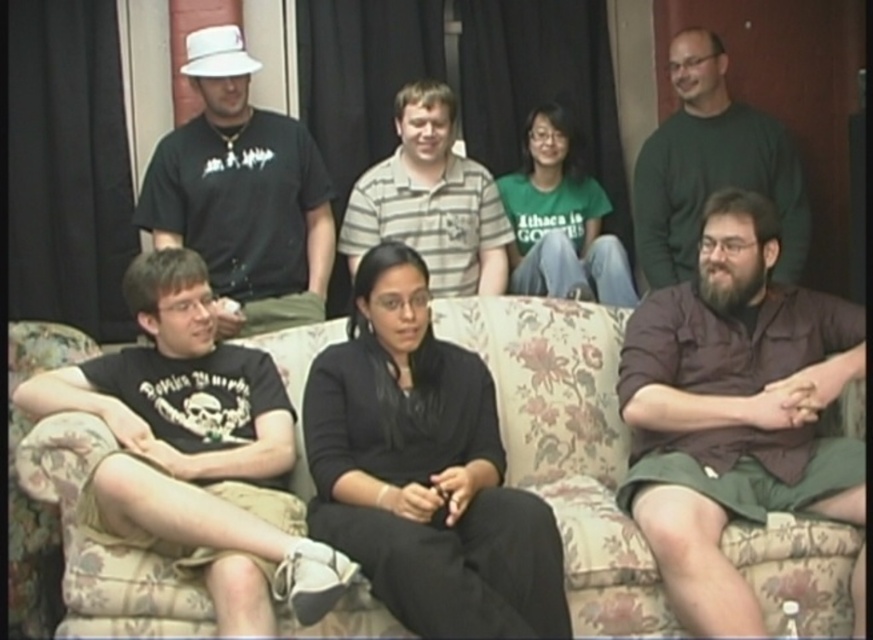
Question: Which object is farther from the camera taking this photo?

Choices:
 (A) matte black t-shirt at upper left
 (B) black matte dress at center
 (C) black cotton t-shirt at left

Answer: (A)

Question: Which of the following is the closest to the observer?

Choices:
 (A) (143, 572)
 (B) (272, 198)

Answer: (A)

Question: Can you confirm if black cotton t-shirt at left is positioned to the left of striped cotton shirt at center?

Choices:
 (A) yes
 (B) no

Answer: (A)

Question: Considering the real-world distances, which object is farthest from the dark green sweater at upper right?

Choices:
 (A) matte black t-shirt at upper left
 (B) brown cotton shirt at center
 (C) black cotton t-shirt at left

Answer: (C)

Question: From the image, what is the correct spatial relationship of brown cotton shirt at center in relation to black matte dress at center?

Choices:
 (A) right
 (B) left

Answer: (A)

Question: Does brown cotton shirt at center have a smaller size compared to matte black t-shirt at upper left?

Choices:
 (A) no
 (B) yes

Answer: (A)